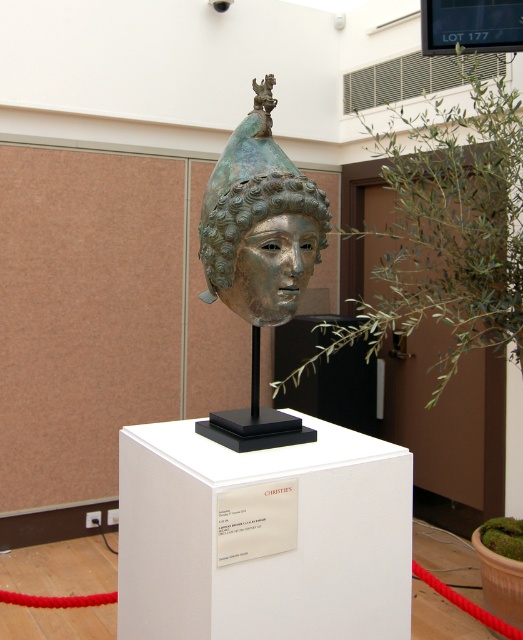
Does green leafy plant at center have a larger size compared to shiny silver mask at center?

Correct, green leafy plant at center is larger in size than shiny silver mask at center.

Between green leafy plant at center and shiny silver mask at center, which one appears on the left side from the viewer's perspective?

Positioned to the left is shiny silver mask at center.

Which is in front, point (374, 136) or point (269, 324)?

Point (269, 324) is in front.

This screenshot has width=523, height=640. Find the location of `green leafy plant at center`. green leafy plant at center is located at coordinates (448, 228).

Which is below, shiny bronze mask at center or shiny silver mask at center?

shiny silver mask at center is lower down.

Does shiny bronze mask at center come in front of shiny silver mask at center?

Yes.

This screenshot has width=523, height=640. Describe the element at coordinates (257, 220) in the screenshot. I see `shiny bronze mask at center` at that location.

You are a GUI agent. You are given a task and a screenshot of the screen. Output one action in this format:
    pyautogui.click(x=<x>, y=<y>)
    Task: Click on the shiny bronze mask at center
    
    Given the screenshot: What is the action you would take?
    pyautogui.click(x=257, y=220)

Which of these two, green leafy plant at center or shiny bronze mask at center, stands taller?

green leafy plant at center is taller.

Does point (460, 161) come behind point (259, 152)?

That is True.

Which is behind, point (472, 237) or point (271, 145)?

Positioned behind is point (472, 237).

In order to click on green leafy plant at center in this screenshot , I will do `click(448, 228)`.